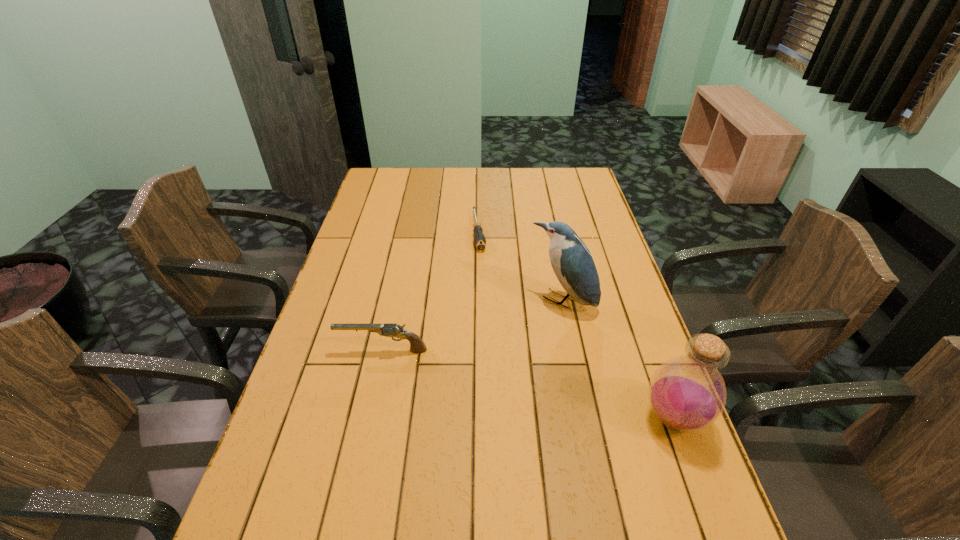
You are a GUI agent. You are given a task and a screenshot of the screen. Output one action in this format:
    pyautogui.click(x=<x>, y=<y>)
    Task: Click on the third tallest object
    This screenshot has height=540, width=960.
    Given the screenshot: What is the action you would take?
    pyautogui.click(x=417, y=345)

Where is `the leftmost object`? the leftmost object is located at coordinates (417, 345).

I want to click on the rightmost object, so click(x=687, y=393).

Locate an element on the screen. The image size is (960, 540). the nearest object is located at coordinates (687, 393).

This screenshot has width=960, height=540. I want to click on bird, so click(x=571, y=260).

Locate an element on the screen. The height and width of the screenshot is (540, 960). the second farthest object is located at coordinates (571, 260).

Locate an element on the screen. This screenshot has height=540, width=960. the second object from left to right is located at coordinates (479, 239).

What are the coordinates of `the shortest object` in the screenshot? It's located at (479, 239).

This screenshot has height=540, width=960. I want to click on free space located aiming along the barrel of the gun, so click(x=316, y=350).

What are the coordinates of `free spot located 0.250m on the left of the nearest object` in the screenshot? It's located at (534, 418).